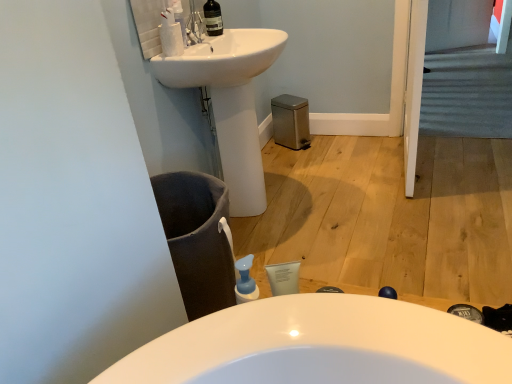
Measure the distance between point (179,4) and camera.

Point (179,4) and camera are 5.36 feet apart from each other.

Where is `white glossy soap dispenser at upper center`? Image resolution: width=512 pixels, height=384 pixels. white glossy soap dispenser at upper center is located at coordinates (179, 17).

You are a GUI agent. You are given a task and a screenshot of the screen. Output one action in this format:
    pyautogui.click(x=<x>, y=<y>)
    Task: Click on the transparent glass bottle at upper center
    
    Given the screenshot: What is the action you would take?
    pyautogui.click(x=213, y=18)

Does white glossy sink at upper center lie behind transparent glass bottle at upper center?

No, it is not.

Considering the sizes of objects white glossy sink at upper center and transparent glass bottle at upper center in the image provided, who is wider, white glossy sink at upper center or transparent glass bottle at upper center?

white glossy sink at upper center.

How distant is white glossy sink at upper center from transparent glass bottle at upper center?

white glossy sink at upper center is 12.90 inches away from transparent glass bottle at upper center.

Is white glossy sink at upper center not within transparent glass bottle at upper center?

white glossy sink at upper center is positioned outside transparent glass bottle at upper center.

Is white glossy sink at upper center not close to white glossy soap dispenser at upper center?

Actually, white glossy sink at upper center and white glossy soap dispenser at upper center are a little close together.

From a real-world perspective, between white glossy sink at upper center and white glossy soap dispenser at upper center, who is vertically lower?

From a 3D spatial view, white glossy sink at upper center is below.

From the image's perspective, which one is positioned higher, white glossy sink at upper center or white glossy soap dispenser at upper center?

white glossy soap dispenser at upper center.

Between point (225, 62) and point (170, 1), which one is positioned in front?

The point (225, 62) is more forward.

Where is `toiletry above the white glossy sink at upper center (from a real-world perspective)`? The height and width of the screenshot is (384, 512). toiletry above the white glossy sink at upper center (from a real-world perspective) is located at coordinates (213, 18).

Is transparent glass bottle at upper center next to white glossy sink at upper center and touching it?

transparent glass bottle at upper center and white glossy sink at upper center are not in contact.

Based on their sizes in the image, would you say transparent glass bottle at upper center is bigger or smaller than white glossy sink at upper center?

In the image, transparent glass bottle at upper center appears to be smaller than white glossy sink at upper center.

Is transparent glass bottle at upper center looking in the opposite direction of white glossy sink at upper center?

transparent glass bottle at upper center is not turned away from white glossy sink at upper center.

Is white matte cleaning product at upper left oriented towards carpeted stairs at upper right?

No.

Find the location of a particular element. cleaning product above the carpeted stairs at upper right (from a real-world perspective) is located at coordinates (170, 34).

Based on the photo, relative to carpeted stairs at upper right, is white matte cleaning product at upper left in front or behind?

Clearly, white matte cleaning product at upper left is in front of carpeted stairs at upper right.

Is white matte cleaning product at upper left in contact with carpeted stairs at upper right?

No, white matte cleaning product at upper left is not next to carpeted stairs at upper right.

Between white glossy sink at upper center and white matte cleaning product at upper left, which one appears on the right side from the viewer's perspective?

Positioned to the right is white glossy sink at upper center.

In the image, there is a white matte cleaning product at upper left. Identify the location of sink below it (from a real-world perspective). (230, 102).

Is white glossy sink at upper center positioned with its back to white matte cleaning product at upper left?

No.

From the image's perspective, does white glossy sink at upper center appear higher than white matte cleaning product at upper left?

Actually, white glossy sink at upper center appears below white matte cleaning product at upper left in the image.

Is white glossy soap dispenser at upper center not inside transparent glass bottle at upper center?

Yes.

Which of these two, white glossy soap dispenser at upper center or transparent glass bottle at upper center, is thinner?

With smaller width is white glossy soap dispenser at upper center.

Relative to transparent glass bottle at upper center, is white glossy soap dispenser at upper center in front or behind?

In the image, white glossy soap dispenser at upper center appears in front of transparent glass bottle at upper center.

Which point is more distant from viewer, (175, 9) or (208, 3)?

Positioned behind is point (208, 3).

Is transparent glass bottle at upper center inside or outside of white matte cleaning product at upper left?

transparent glass bottle at upper center exists outside the volume of white matte cleaning product at upper left.

Can you confirm if transparent glass bottle at upper center is bigger than white matte cleaning product at upper left?

Correct, transparent glass bottle at upper center is larger in size than white matte cleaning product at upper left.

Considering the positions of objects transparent glass bottle at upper center and white matte cleaning product at upper left in the image provided, who is more to the right, transparent glass bottle at upper center or white matte cleaning product at upper left?

transparent glass bottle at upper center.

How many degrees apart are the facing directions of transparent glass bottle at upper center and white matte cleaning product at upper left?

6.13 degrees.

Identify the location of sink on the right side of transparent glass bottle at upper center. (230, 102).

Locate an element on the screen. This screenshot has height=384, width=512. bottle on the left of white glossy sink at upper center is located at coordinates (179, 17).

Estimate the real-world distances between objects in this image. Which object is further from white matte cleaning product at upper left, white glossy sink at upper center or carpeted stairs at upper right?

The object further to white matte cleaning product at upper left is carpeted stairs at upper right.

Looking at the image, which one is located closer to white matte cleaning product at upper left, white glossy soap dispenser at upper center or white glossy sink at upper center?

white glossy soap dispenser at upper center lies closer to white matte cleaning product at upper left than the other object.

From the image, which object appears to be nearer to white matte cleaning product at upper left, carpeted stairs at upper right or white glossy sink at upper center?

A: white glossy sink at upper center.

Looking at the image, which one is located further to carpeted stairs at upper right, transparent glass bottle at upper center or white glossy soap dispenser at upper center?

white glossy soap dispenser at upper center is further to carpeted stairs at upper right.

From the image, which object appears to be farther from white glossy soap dispenser at upper center, white glossy sink at upper center or transparent glass bottle at upper center?

Among the two, white glossy sink at upper center is located further to white glossy soap dispenser at upper center.

From the image, which object appears to be farther from white glossy sink at upper center, transparent glass bottle at upper center or white glossy soap dispenser at upper center?

white glossy soap dispenser at upper center is positioned further to the anchor white glossy sink at upper center.

Looking at the image, which one is located closer to carpeted stairs at upper right, white glossy soap dispenser at upper center or white matte cleaning product at upper left?

white matte cleaning product at upper left.

Based on their spatial positions, is carpeted stairs at upper right or white glossy soap dispenser at upper center further from transparent glass bottle at upper center?

carpeted stairs at upper right.

Identify the location of toiletry located between white matte cleaning product at upper left and carpeted stairs at upper right in the left-right direction. (213, 18).

Locate an element on the screen. The width and height of the screenshot is (512, 384). sink between white glossy soap dispenser at upper center and carpeted stairs at upper right in the horizontal direction is located at coordinates (230, 102).

At what (x,y) coordinates should I click in order to perform the action: click on bottle that lies between transparent glass bottle at upper center and white glossy sink at upper center from top to bottom. Please return your answer as a coordinate pair (x, y). Looking at the image, I should click on (179, 17).

This screenshot has width=512, height=384. Find the location of `bottle between white matte cleaning product at upper left and carpeted stairs at upper right`. bottle between white matte cleaning product at upper left and carpeted stairs at upper right is located at coordinates (179, 17).